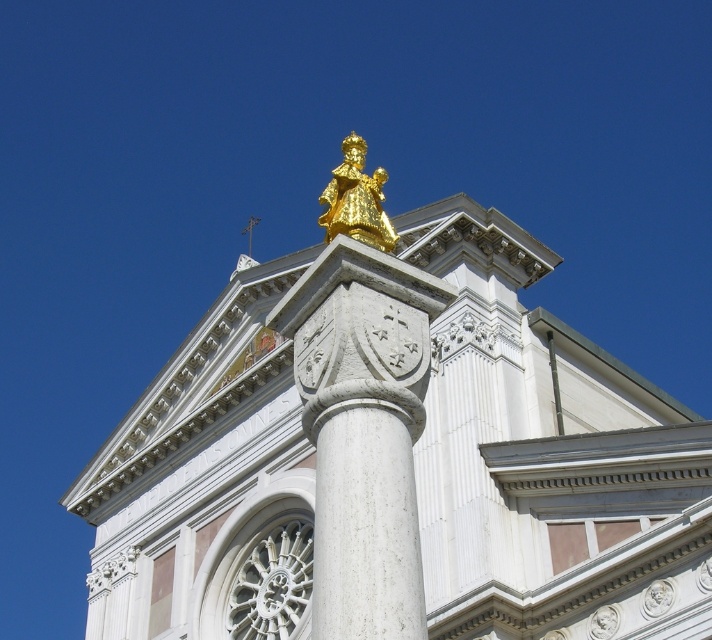
You are standing at a certain distance from the gold statue at center and want to take a photo of it. The recommended distance for capturing the statue in full frame is 50 feet. Will you need to move closer or farther away?

The gold statue at center and camera are 56.73 feet apart. Since the recommended distance is 50 feet, you need to move closer by approximately 6.73 feet to ensure the statue fits within the full frame.

You are an art student observing the classical architectural structure. You notice two statues made of gold. The first is the gold statue at center, and the second is the gold polished statue at upper center. Which of these two statues is located higher up in the structure?

The gold polished statue at upper center is located higher up in the structure than the gold statue at center.

You are an architect assessing the proportions of the building. Given that the gold statue at center and the white marble column at center are both central elements, which one is taller?

The gold statue at center is taller than the white marble column at center according to the description.